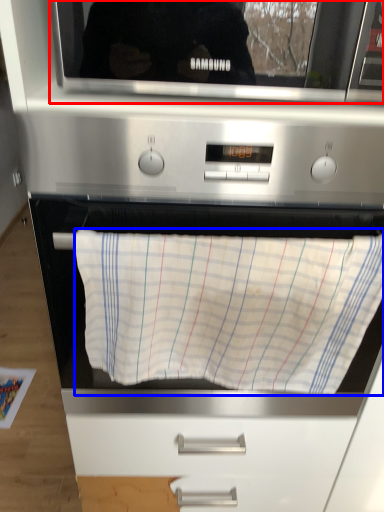
Question: Which object appears farthest to the camera in this image, microwave oven (highlighted by a red box) or blanket (highlighted by a blue box)?

Choices:
 (A) microwave oven
 (B) blanket

Answer: (B)